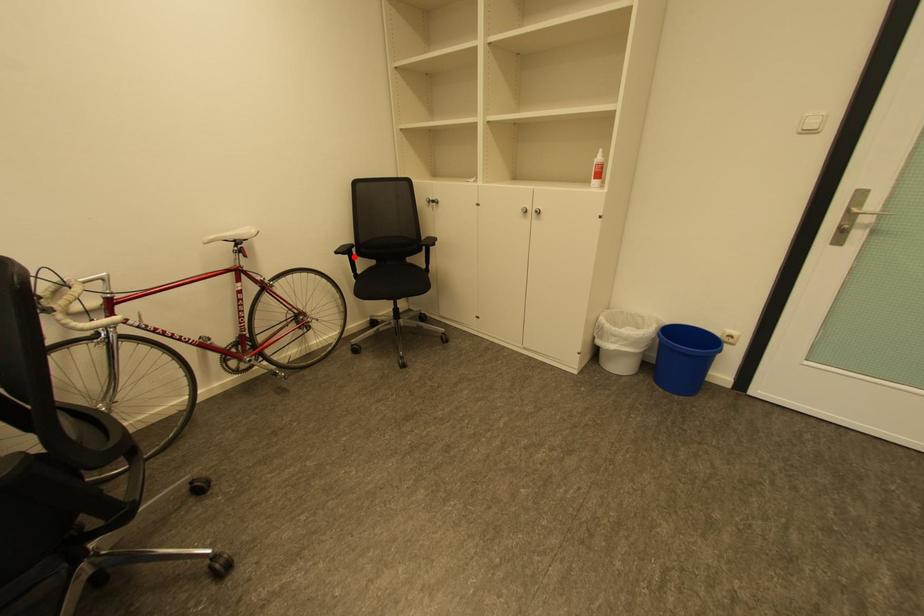
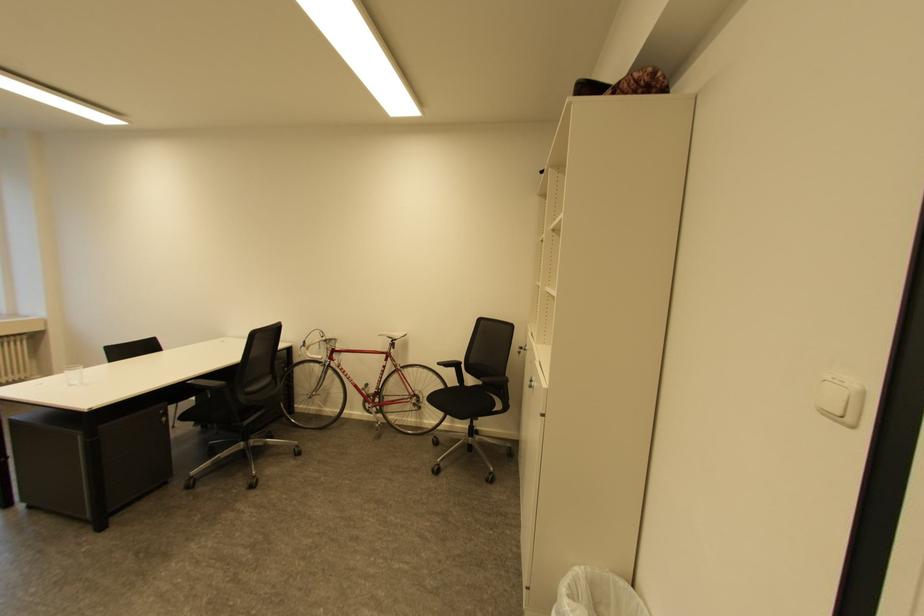
Find the pixel in the second image that matches the highlighted location in the first image.

(459, 370)